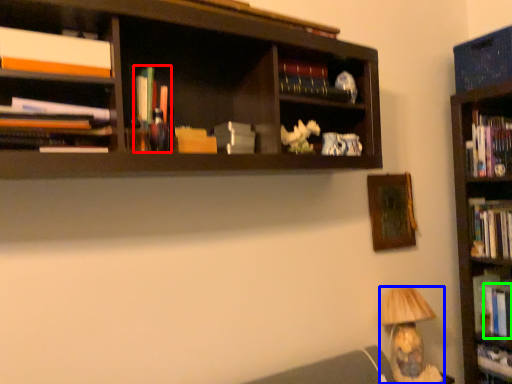
Question: Estimate the real-world distances between objects in this image. Which object is closer to book (highlighted by a red box), lamp (highlighted by a blue box) or book (highlighted by a green box)?

Choices:
 (A) lamp
 (B) book

Answer: (A)